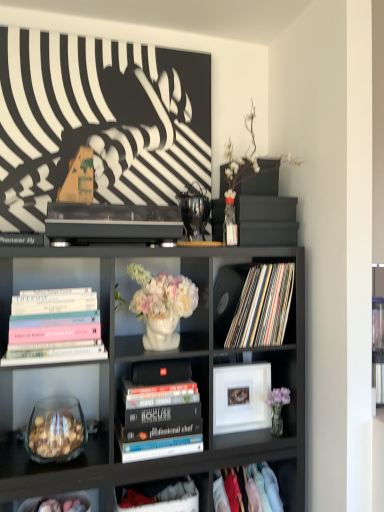
Question: Is matte white picture frame at center positioned before white glossy vase at center, which is the 2th shelf from right to left?

Choices:
 (A) no
 (B) yes

Answer: (A)

Question: Considering the relative sizes of matte white picture frame at center and white glossy vase at center, which appears as the first shelf when viewed from the left, in the image provided, is matte white picture frame at center smaller than white glossy vase at center, which appears as the first shelf when viewed from the left,?

Choices:
 (A) no
 (B) yes

Answer: (B)

Question: Does matte white picture frame at center have a greater height compared to white glossy vase at center, which is the 2th shelf from right to left?

Choices:
 (A) yes
 (B) no

Answer: (B)

Question: From a real-world perspective, is matte white picture frame at center positioned over white glossy vase at center, which is the 2th shelf from right to left, based on gravity?

Choices:
 (A) no
 (B) yes

Answer: (A)

Question: Is matte white picture frame at center touching white glossy vase at center, which is the 2th shelf from right to left?

Choices:
 (A) no
 (B) yes

Answer: (A)

Question: Is white glossy vase at center, the second shelf in the bottom-to-top sequence, at the back of matte white picture frame at center?

Choices:
 (A) no
 (B) yes

Answer: (A)

Question: Does cloth at lower right, marked as the first shelf in a bottom-to-top arrangement, contain hardcover books at center, placed as the first book when sorted from bottom to top?

Choices:
 (A) yes
 (B) no

Answer: (B)

Question: From a real-world perspective, is cloth at lower right, marked as the first shelf in a bottom-to-top arrangement, located beneath hardcover books at center, arranged as the 2th book when viewed from the left?

Choices:
 (A) no
 (B) yes

Answer: (B)

Question: Is cloth at lower right, marked as the first shelf in a bottom-to-top arrangement, at the left side of hardcover books at center, which ranks as the third book in top-to-bottom order?

Choices:
 (A) yes
 (B) no

Answer: (B)

Question: From the image's perspective, is cloth at lower right, marked as the 2th shelf in a left-to-right arrangement, under hardcover books at center, which ranks as the third book in top-to-bottom order?

Choices:
 (A) yes
 (B) no

Answer: (A)

Question: Is cloth at lower right, the second shelf positioned from the top, closer to the viewer compared to hardcover books at center, which ranks as the third book in top-to-bottom order?

Choices:
 (A) no
 (B) yes

Answer: (A)

Question: Considering the relative sizes of cloth at lower right, which appears as the first shelf when viewed from the right, and hardcover books at center, arranged as the 2th book when viewed from the left, in the image provided, is cloth at lower right, which appears as the first shelf when viewed from the right, taller than hardcover books at center, arranged as the 2th book when viewed from the left,?

Choices:
 (A) yes
 (B) no

Answer: (A)

Question: Would you say matte vinyl records at center, the third book from the bottom, is outside cloth at lower right, the second shelf positioned from the top?

Choices:
 (A) no
 (B) yes

Answer: (B)